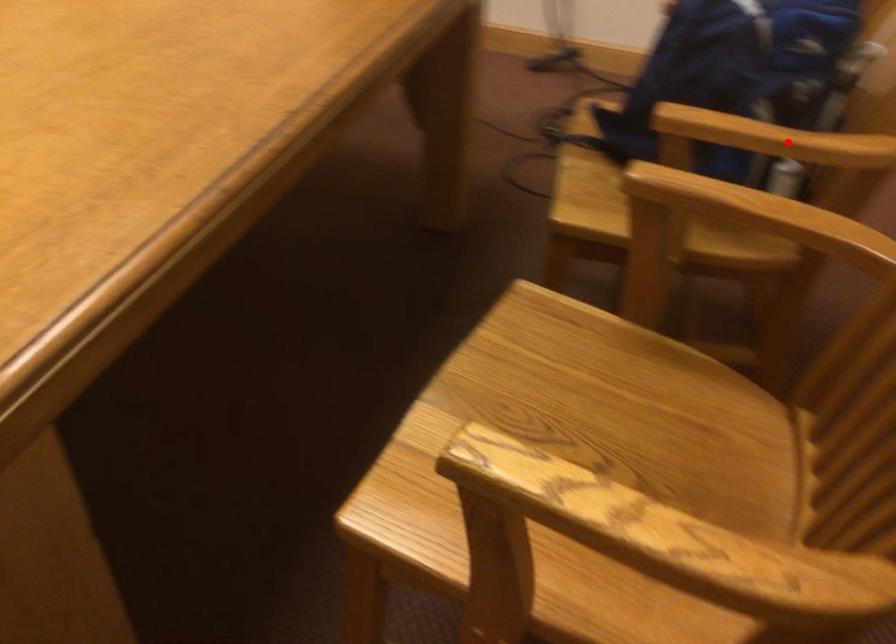
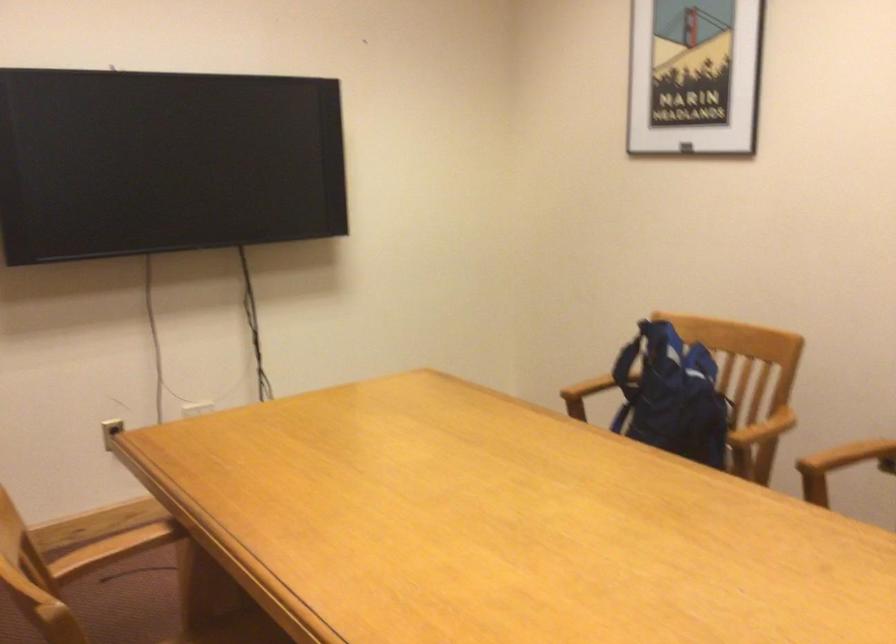
Where in the second image is the point corresponding to the highlighted location from the first image?

(763, 428)